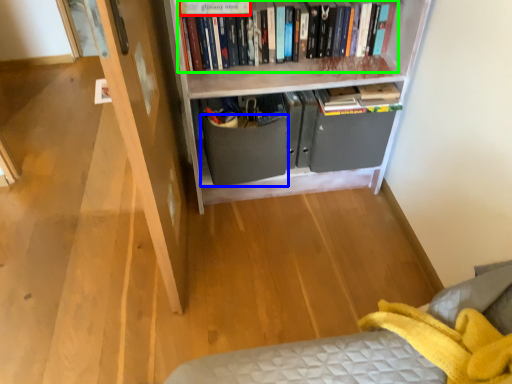
Question: Considering the real-world distances, which object is farthest from paperback book (highlighted by a red box)? drawer (highlighted by a blue box) or book (highlighted by a green box)?

Choices:
 (A) drawer
 (B) book

Answer: (A)